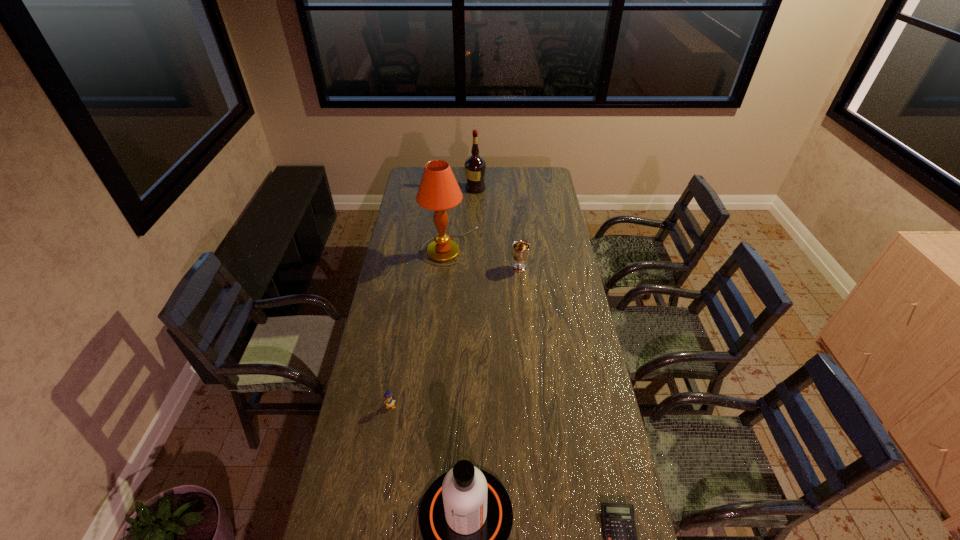
Select which object is the fourth closest to the rightmost object. Please provide its 2D coordinates. Your answer should be formatted as a tuple, i.e. [(x, y)], where the tuple contains the x and y coordinates of a point satisfying the conditions above.

[(438, 190)]

Find the location of a particular element. This screenshot has width=960, height=540. free region that satisfies the following two spatial constraints: 1. on the label of the alcohol; 2. on the right side of the chalice is located at coordinates (474, 268).

Where is `free spot that satisfies the following two spatial constraints: 1. on the label of the third shortest object; 2. on the left side of the farthest object`? The image size is (960, 540). free spot that satisfies the following two spatial constraints: 1. on the label of the third shortest object; 2. on the left side of the farthest object is located at coordinates (474, 268).